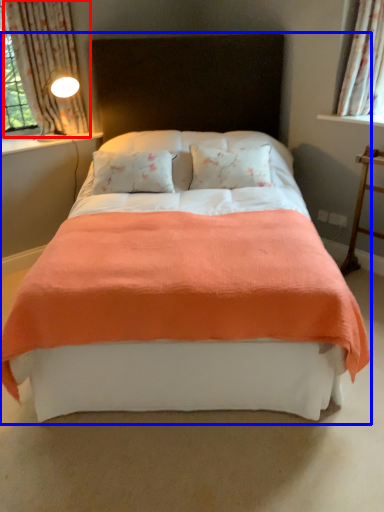
Question: Which object appears farthest to the camera in this image, curtain (highlighted by a red box) or bed (highlighted by a blue box)?

Choices:
 (A) curtain
 (B) bed

Answer: (A)